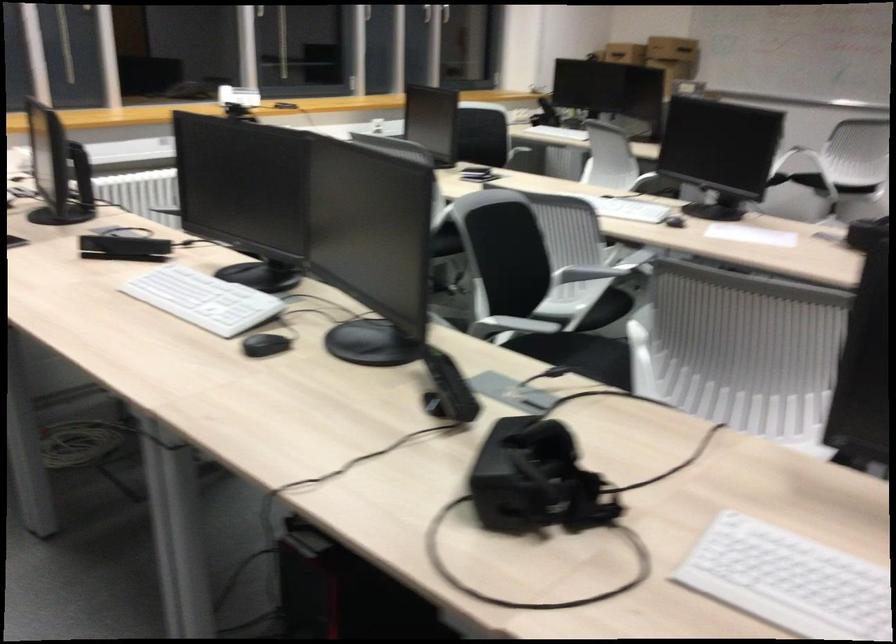
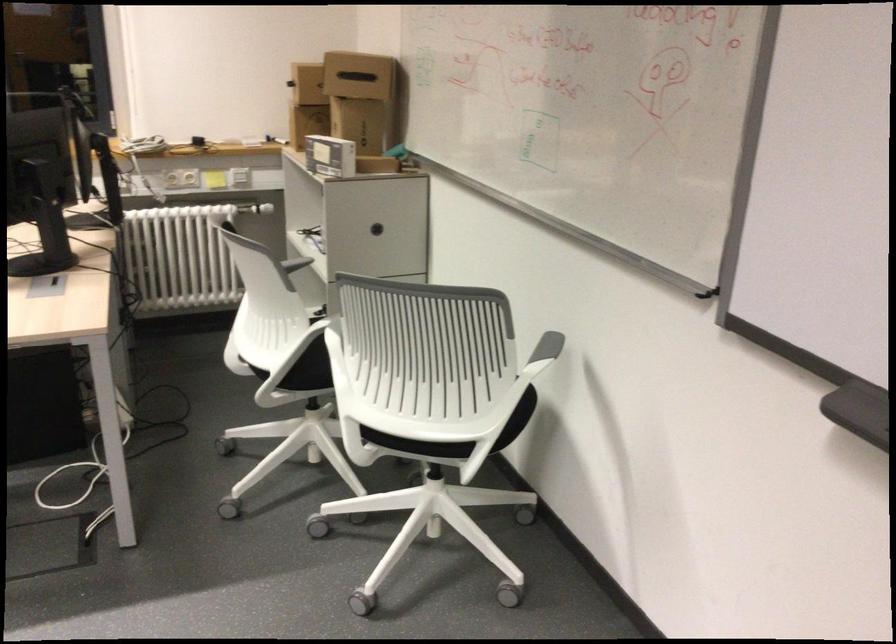
In the second image, find the point that corresponds to the point at 787,169 in the first image.

(307, 375)